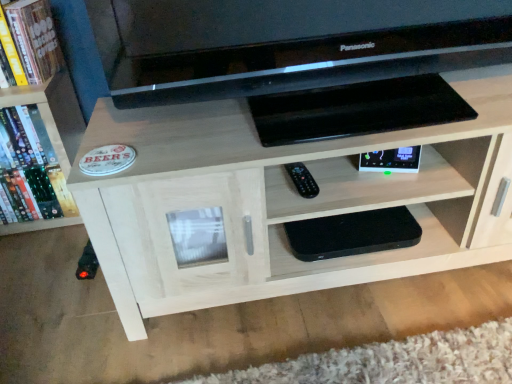
I want to click on free area below black glossy tv at upper center (from a real-world perspective), so click(x=330, y=117).